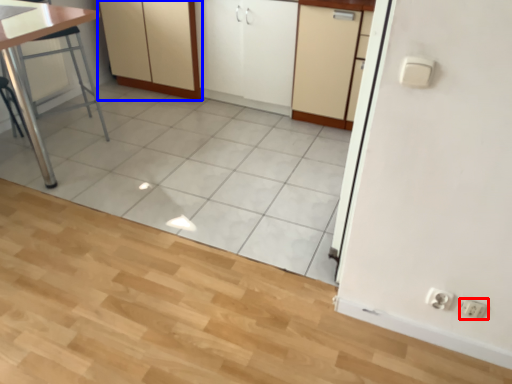
Question: Which object is closer to the camera taking this photo, electric outlet (highlighted by a red box) or cabinetry (highlighted by a blue box)?

Choices:
 (A) electric outlet
 (B) cabinetry

Answer: (A)